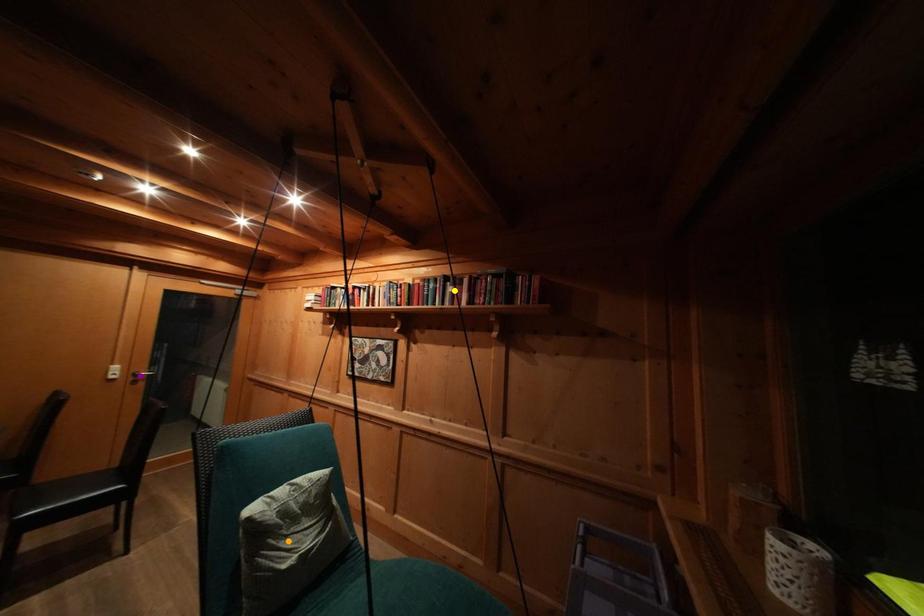
Order these from nearest to farthest:
purple point
yellow point
orange point

orange point
yellow point
purple point